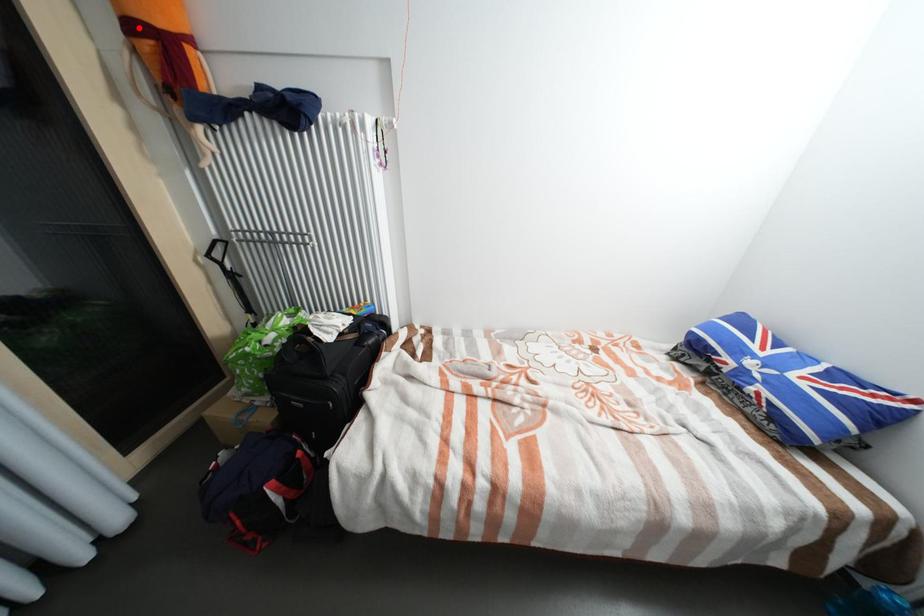
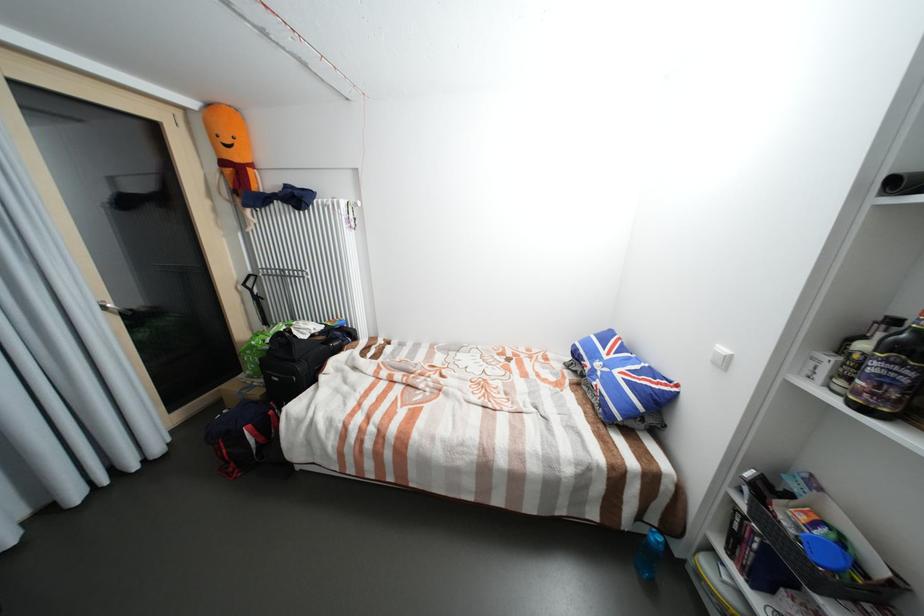
The point at the highlighted location is marked in the first image. Where is the corresponding point in the second image?

(229, 163)